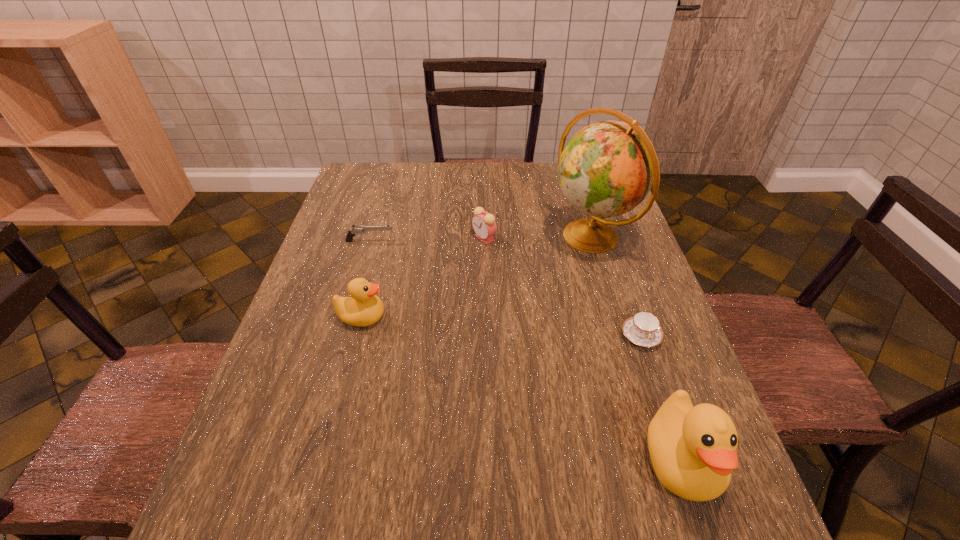
This screenshot has width=960, height=540. In order to click on free region located on the front of the globe in this screenshot , I will do `click(606, 282)`.

The height and width of the screenshot is (540, 960). Identify the location of vacant space located on the face of the fourth tallest object. (417, 238).

Where is `free space located 0.360m on the face of the fourth tallest object`? This screenshot has width=960, height=540. free space located 0.360m on the face of the fourth tallest object is located at coordinates [347, 238].

This screenshot has width=960, height=540. In order to click on vacant area situated on the face of the fourth tallest object in this screenshot , I will do pyautogui.click(x=372, y=238).

The image size is (960, 540). What are the coordinates of `vacant area situated on the front-facing side of the second shortest object` in the screenshot? It's located at (430, 241).

Where is `vacant space located on the side with the handle of the teacup`? This screenshot has width=960, height=540. vacant space located on the side with the handle of the teacup is located at coordinates (656, 379).

Where is `object located at the near edge`? The width and height of the screenshot is (960, 540). object located at the near edge is located at coordinates (693, 450).

You are a GUI agent. You are given a task and a screenshot of the screen. Output one action in this format:
    pyautogui.click(x=<x>, y=<y>)
    Task: Click on the duck present at the left edge
    This screenshot has height=540, width=960.
    Given the screenshot: What is the action you would take?
    pyautogui.click(x=363, y=308)

Find the location of a particular element. The image size is (960, 540). pistol at the left edge is located at coordinates (355, 230).

Where is `duck that is at the right edge`? duck that is at the right edge is located at coordinates (693, 450).